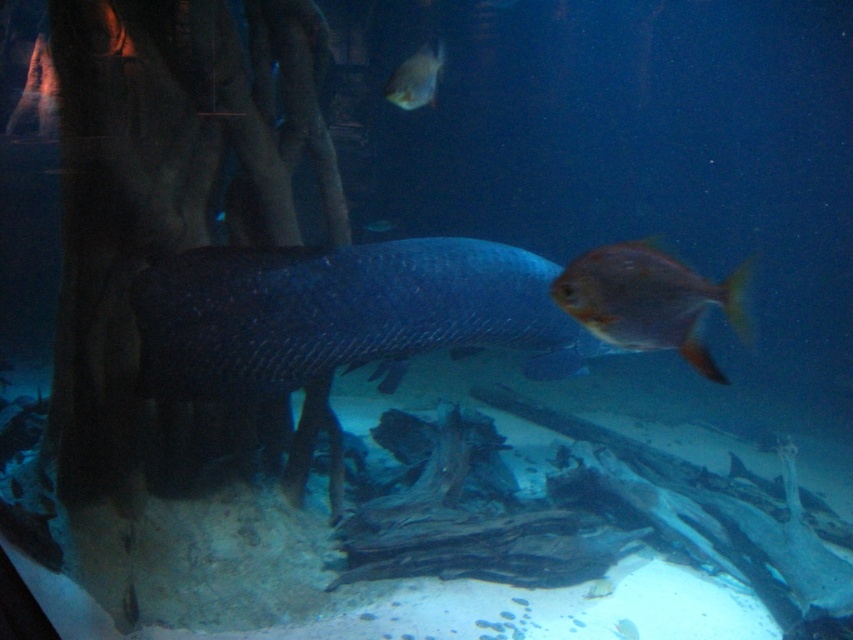
From the picture: Is shiny orange fish at upper right to the right of shiny silver fish at upper center from the viewer's perspective?

Yes, shiny orange fish at upper right is to the right of shiny silver fish at upper center.

Based on the photo, does shiny orange fish at upper right have a smaller size compared to shiny silver fish at upper center?

Actually, shiny orange fish at upper right might be larger than shiny silver fish at upper center.

What do you see at coordinates (648, 300) in the screenshot?
I see `shiny orange fish at upper right` at bounding box center [648, 300].

The width and height of the screenshot is (853, 640). I want to click on shiny orange fish at upper right, so click(x=648, y=300).

Which is in front, point (292, 282) or point (431, 68)?

Point (292, 282) is in front.

At what (x,y) coordinates should I click in order to perform the action: click on shiny blue fish at center. Please return your answer as a coordinate pair (x, y). Looking at the image, I should click on (344, 312).

Identify the location of shiny blue fish at center. The image size is (853, 640). (344, 312).

Does shiny blue fish at center have a lesser width compared to shiny orange fish at upper right?

No, shiny blue fish at center is not thinner than shiny orange fish at upper right.

The image size is (853, 640). Find the location of `shiny blue fish at center`. shiny blue fish at center is located at coordinates (344, 312).